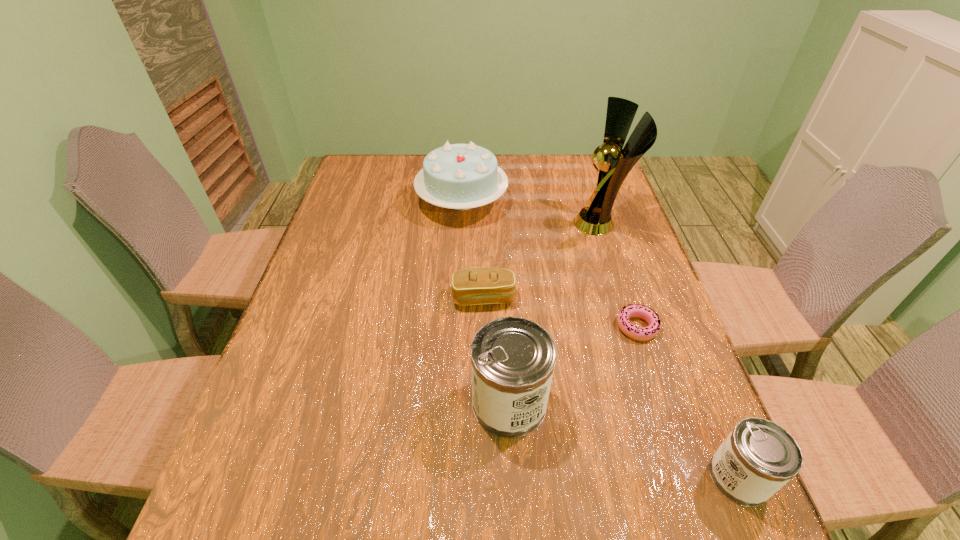
Identify the location of vacant region that satisfies the following two spatial constraints: 1. on the front side of the birthday cake; 2. on the right side of the taller can. (451, 403).

Locate an element on the screen. The image size is (960, 540). vacant area that satisfies the following two spatial constraints: 1. on the front side of the shortest object; 2. on the right side of the birthday cake is located at coordinates (455, 327).

Identify the location of free region that satisfies the following two spatial constraints: 1. at the front of the award, where the globe is visible; 2. on the right side of the shortest object. point(636,327).

Locate an element on the screen. This screenshot has width=960, height=540. free space that satisfies the following two spatial constraints: 1. on the zipper side of the clutch bag; 2. on the left side of the second nearest object is located at coordinates (485, 403).

The image size is (960, 540). In order to click on free location that satisfies the following two spatial constraints: 1. on the zipper side of the shortest object; 2. on the left side of the clutch bag in this screenshot , I will do `click(484, 327)`.

In order to click on vacant point that satisfies the following two spatial constraints: 1. at the front of the award, where the globe is visible; 2. on the front side of the second nearest object in this screenshot , I will do `click(660, 403)`.

At what (x,y) coordinates should I click in order to perform the action: click on vacant region that satisfies the following two spatial constraints: 1. at the front of the nearer can, where the globe is visible; 2. on the right side of the tallest object. Please return your answer as a coordinate pair (x, y). The image size is (960, 540). Looking at the image, I should click on (684, 477).